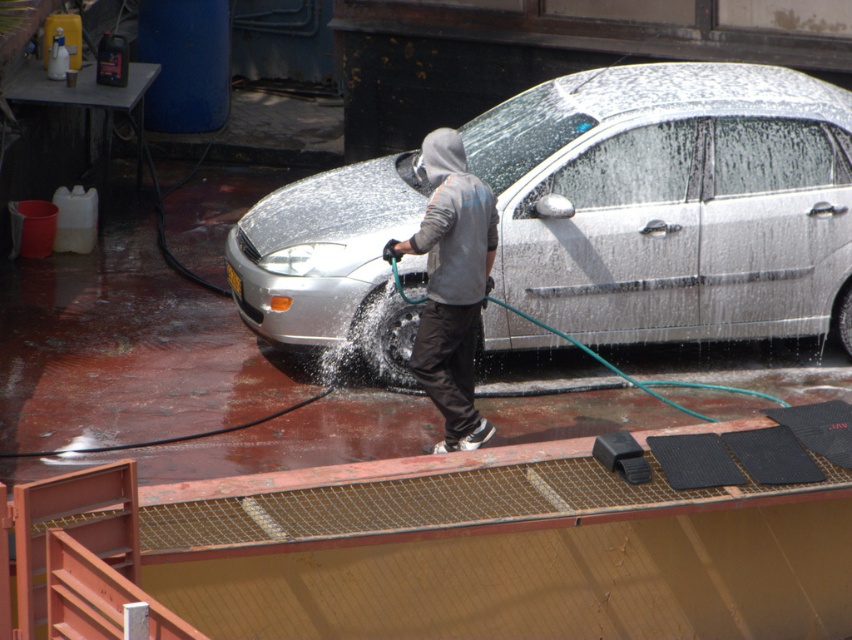
Question: Can you confirm if silver metallic car at center is positioned to the right of gray hoodie at center?

Choices:
 (A) no
 (B) yes

Answer: (B)

Question: Does silver metallic car at center have a larger size compared to gray hoodie at center?

Choices:
 (A) no
 (B) yes

Answer: (B)

Question: Among these objects, which one is farthest from the camera?

Choices:
 (A) gray hoodie at center
 (B) silver metallic car at center

Answer: (B)

Question: Which object is closer to the camera taking this photo?

Choices:
 (A) silver metallic car at center
 (B) gray hoodie at center

Answer: (B)

Question: Is silver metallic car at center smaller than gray hoodie at center?

Choices:
 (A) no
 (B) yes

Answer: (A)